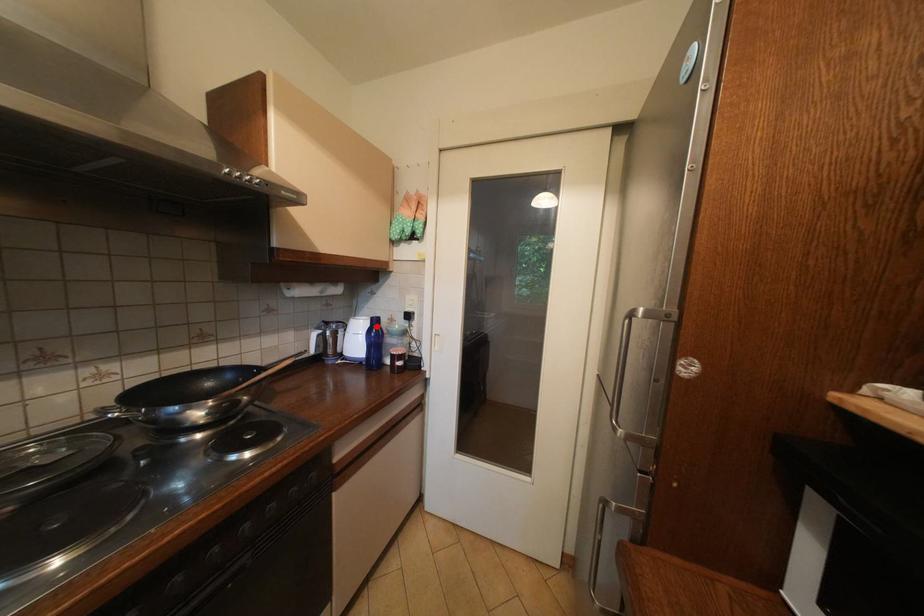
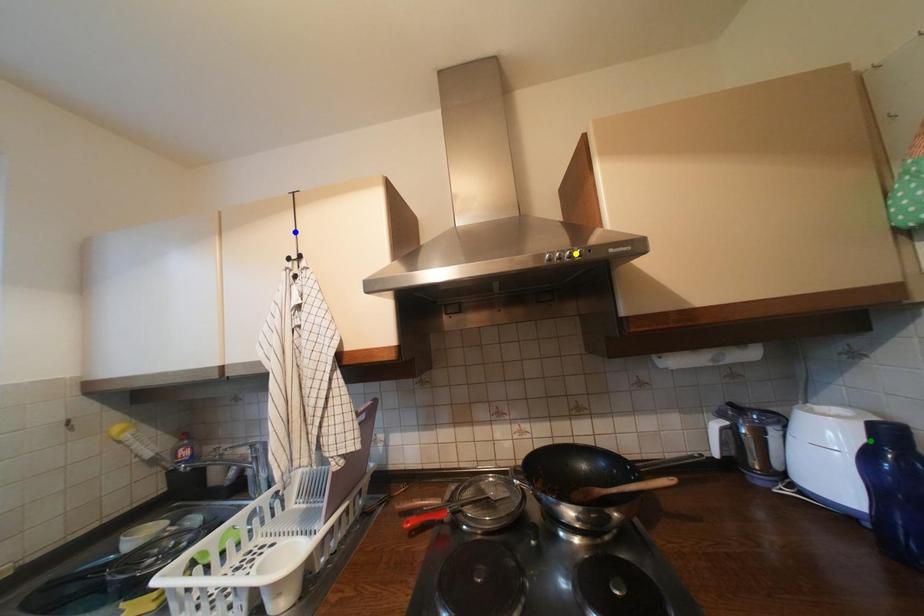
Question: I am providing you with two images of the same scene from different viewpoints. A red point is marked on the first image. You are given multiple points on the second image. Which mark in image 2 goes with the point in image 1?

Choices:
 (A) yellow point
 (B) blue point
 (C) green point

Answer: (C)